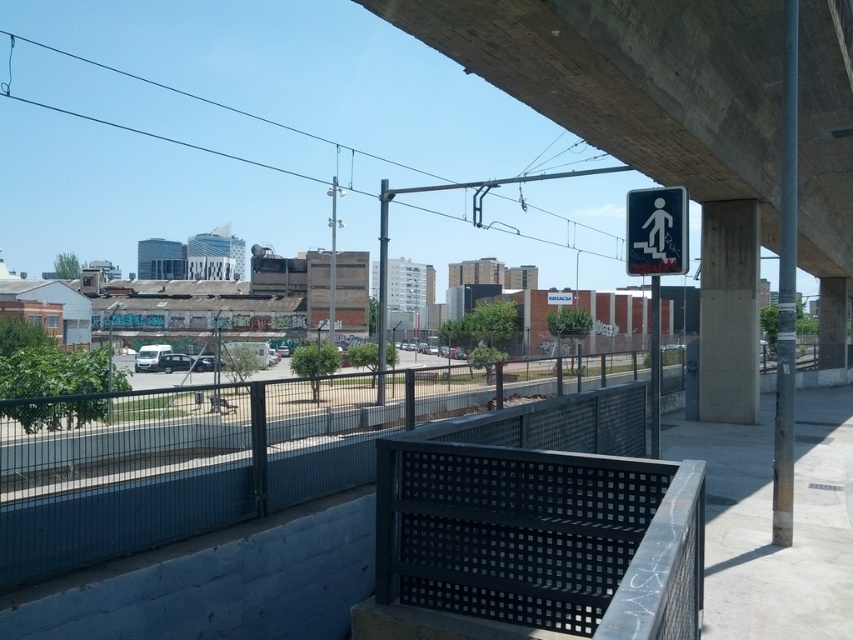
Does concrete at upper right have a smaller size compared to white plastic pedestrian sign at upper center?

No, concrete at upper right is not smaller than white plastic pedestrian sign at upper center.

Which of these two, concrete at upper right or white plastic pedestrian sign at upper center, stands shorter?

white plastic pedestrian sign at upper center is shorter.

Who is more forward, [757,58] or [628,218]?

Positioned in front is point [628,218].

At what (x,y) coordinates should I click in order to perform the action: click on concrete at upper right. Please return your answer as a coordinate pair (x, y). Looking at the image, I should click on pos(633,80).

What do you see at coordinates (541, 538) in the screenshot? The width and height of the screenshot is (853, 640). I see `black perforated metal bench at lower center` at bounding box center [541, 538].

Which is above, black perforated metal bench at lower center or white plastic pedestrian sign at upper center?

Positioned higher is white plastic pedestrian sign at upper center.

Where is `black perforated metal bench at lower center`? black perforated metal bench at lower center is located at coordinates (541, 538).

Which is more to the left, concrete at upper right or black perforated metal bench at lower center?

From the viewer's perspective, black perforated metal bench at lower center appears more on the left side.

Based on the photo, who is more distant from viewer, (466, 1) or (604, 480)?

The point (466, 1) is more distant.

Identify the location of concrete at upper right. This screenshot has height=640, width=853. (633, 80).